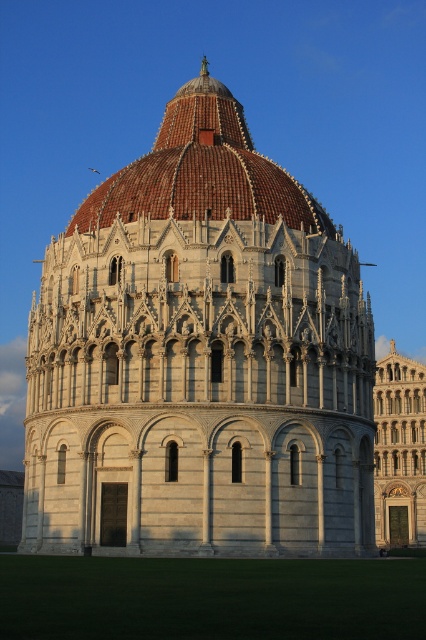
Question: Is brown tiled dome at center positioned behind golden stone tower at center?

Choices:
 (A) yes
 (B) no

Answer: (B)

Question: Is white stone tower at center closer to camera compared to brown tiled dome at center?

Choices:
 (A) yes
 (B) no

Answer: (A)

Question: Is brown tiled dome at center to the right of golden stone tower at center from the viewer's perspective?

Choices:
 (A) yes
 (B) no

Answer: (B)

Question: Which point is closer to the camera taking this photo?

Choices:
 (A) (172, 99)
 (B) (314, 502)
 (C) (414, 506)

Answer: (B)

Question: Which point is farther to the camera?

Choices:
 (A) golden stone tower at center
 (B) white stone tower at center
 (C) brown tiled dome at center

Answer: (A)

Question: Which object is closer to the camera taking this photo?

Choices:
 (A) brown tiled dome at center
 (B) white stone tower at center
 (C) golden stone tower at center

Answer: (B)